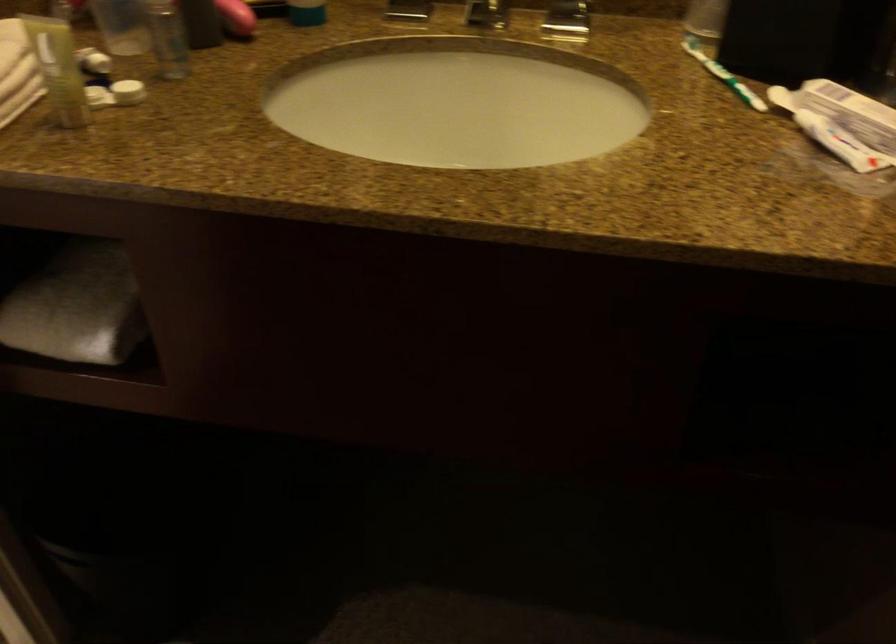
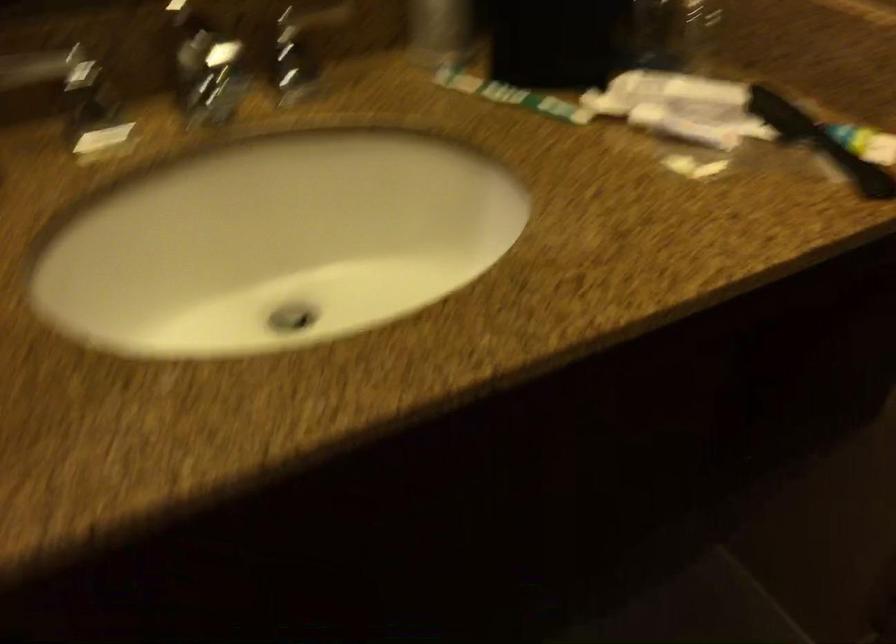
Question: The camera is either moving clockwise (left) or counter-clockwise (right) around the object. The first image is from the beginning of the video and the second image is from the end. Is the camera moving left or right when shooting the video?

Choices:
 (A) Left
 (B) Right

Answer: (A)